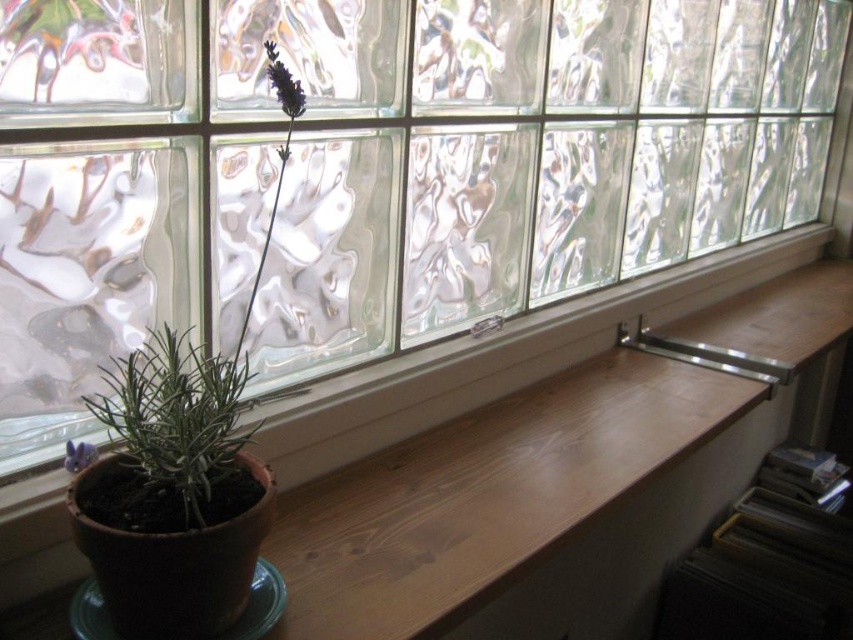
Which is in front, point (653, 520) or point (207, 435)?

Point (207, 435)

Between wooden ledge at lower center and green matte plant at lower left, which one has less height?

Standing shorter between the two is green matte plant at lower left.

What are the coordinates of `wooden ledge at lower center` in the screenshot? It's located at (555, 476).

Does point (171, 337) come in front of point (149, 493)?

No.

Which is above, green matte plant at left or green matte plant at lower left?

Positioned higher is green matte plant at left.

From the picture: Measure the distance between green matte plant at left and camera.

green matte plant at left and camera are 65.28 centimeters apart from each other.

This screenshot has height=640, width=853. I want to click on green matte plant at left, so click(x=189, y=385).

Find the location of a particular element. This screenshot has height=640, width=853. wooden ledge at lower center is located at coordinates (555, 476).

You are a GUI agent. You are given a task and a screenshot of the screen. Output one action in this format:
    pyautogui.click(x=<x>, y=<y>)
    Task: Click on the wooden ledge at lower center
    Image resolution: width=853 pixels, height=640 pixels.
    Given the screenshot: What is the action you would take?
    555,476

This screenshot has height=640, width=853. I want to click on wooden ledge at lower center, so click(555, 476).